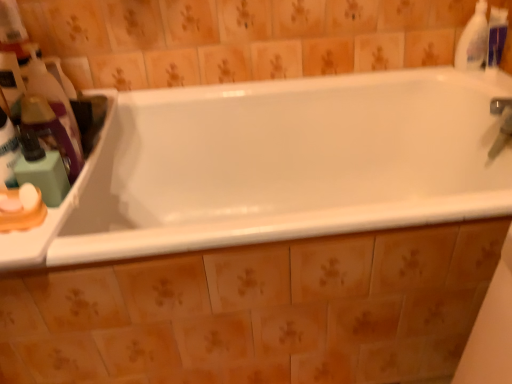
Locate an element on the screen. This screenshot has width=512, height=384. white plastic counter at left is located at coordinates (41, 228).

Locate an element on the screen. Image resolution: width=512 pixels, height=384 pixels. matte green soap at left is located at coordinates (42, 169).

Measure the distance between white glossy bathtub at center and camera.

white glossy bathtub at center and camera are 1.07 meters apart from each other.

The width and height of the screenshot is (512, 384). In order to click on white plastic counter at left in this screenshot , I will do `click(41, 228)`.

Where is `the 1st cleaning product directly above the translucent plastic bottle at left, marked as the 1th cleaning product in a front-to-back arrangement (from a real-world perspective)`? The image size is (512, 384). the 1st cleaning product directly above the translucent plastic bottle at left, marked as the 1th cleaning product in a front-to-back arrangement (from a real-world perspective) is located at coordinates (473, 40).

Is translucent plastic bottle at left, which is the third cleaning product in back-to-front order, bigger or smaller than white plastic bottle at upper right, the first cleaning product when ordered from back to front?

In the image, translucent plastic bottle at left, which is the third cleaning product in back-to-front order, appears to be larger than white plastic bottle at upper right, the first cleaning product when ordered from back to front.

Considering the sizes of objects matte green soap at left and translucent plastic bottle at left, the 1th cleaning product when ordered from left to right, in the image provided, who is thinner, matte green soap at left or translucent plastic bottle at left, the 1th cleaning product when ordered from left to right,?

Thinner between the two is matte green soap at left.

Between point (33, 157) and point (45, 68), which one is positioned behind?

The point (45, 68) is more distant.

Is matte green soap at left facing away from translucent plastic bottle at left, the 1th cleaning product when ordered from left to right?

No.

Is point (474, 48) closer to viewer compared to point (47, 121)?

No, (474, 48) is behind (47, 121).

Which of these two, white plastic bottle at upper right, which is the 1th cleaning product from right to left, or translucent plastic bottle at left, which is the third cleaning product in back-to-front order, stands taller?

white plastic bottle at upper right, which is the 1th cleaning product from right to left, is taller.

Would you consider white glossy bathtub at center to be distant from white plastic counter at left?

No, white glossy bathtub at center is in close proximity to white plastic counter at left.

From the image's perspective, would you say white glossy bathtub at center is positioned over white plastic counter at left?

No, from the image's perspective, white glossy bathtub at center is not on top of white plastic counter at left.

Could you tell me if white glossy bathtub at center is turned towards white plastic counter at left?

No, white glossy bathtub at center is not facing towards white plastic counter at left.

Which object is further away from the camera taking this photo, white glossy bathtub at center or white plastic bottle at upper right, the first cleaning product when ordered from back to front?

white plastic bottle at upper right, the first cleaning product when ordered from back to front, is further away from the camera.

Is point (358, 146) positioned before point (475, 44)?

No, it is not.

You are a GUI agent. You are given a task and a screenshot of the screen. Output one action in this format:
    pyautogui.click(x=<x>, y=<y>)
    Task: Click on the bathtub below the white plastic bottle at upper right, the third cleaning product viewed from the front (from the image's perspective)
    Image resolution: width=512 pixels, height=384 pixels.
    Given the screenshot: What is the action you would take?
    pos(278,166)

Measure the distance between translucent plastic bottle at left, the 1th cleaning product when ordered from left to right, and white glossy bathtub at center.

translucent plastic bottle at left, the 1th cleaning product when ordered from left to right, is 22.58 inches away from white glossy bathtub at center.

Consider the image. Is translucent plastic bottle at left, marked as the 2th cleaning product in a back-to-front arrangement, located outside white glossy bathtub at center?

Yes, translucent plastic bottle at left, marked as the 2th cleaning product in a back-to-front arrangement, is located beyond the bounds of white glossy bathtub at center.

There is a white glossy bathtub at center. Where is `the 2nd cleaning product above it (from the image's perspective)`? Image resolution: width=512 pixels, height=384 pixels. the 2nd cleaning product above it (from the image's perspective) is located at coordinates (53, 99).

Considering the points (67, 123) and (379, 102), which point is behind, point (67, 123) or point (379, 102)?

Positioned behind is point (379, 102).

Which of these two, translucent plastic bottle at left, acting as the second cleaning product starting from the right, or white glossy bathtub at center, stands shorter?

translucent plastic bottle at left, acting as the second cleaning product starting from the right.

Choose the correct answer: Is translucent plastic bottle at left, which is the third cleaning product in back-to-front order, inside white glossy bathtub at center or outside it?

translucent plastic bottle at left, which is the third cleaning product in back-to-front order, is not inside white glossy bathtub at center, it's outside.

From the image's perspective, is translucent plastic bottle at left, marked as the 1th cleaning product in a front-to-back arrangement, above or below white glossy bathtub at center?

translucent plastic bottle at left, marked as the 1th cleaning product in a front-to-back arrangement, is above white glossy bathtub at center.

From the image's perspective, starting from the translucent plastic bottle at left, acting as the second cleaning product starting from the right, which cleaning product is the 2nd one above? Please provide its 2D coordinates.

[(473, 40)]

Locate an element on the screen. The image size is (512, 384). toiletry in front of the translucent plastic bottle at left, marked as the 2th cleaning product in a back-to-front arrangement is located at coordinates (42, 169).

From the image, which object appears to be nearer to white plastic bottle at upper right, the first cleaning product when ordered from back to front, translucent plastic bottle at left, acting as the third cleaning product starting from the right, or white plastic counter at left?

white plastic counter at left lies closer to white plastic bottle at upper right, the first cleaning product when ordered from back to front, than the other object.

When comparing their distances from white plastic bottle at upper right, the third cleaning product viewed from the front, does white glossy bathtub at center or translucent plastic bottle at left, acting as the 2th cleaning product starting from the left, seem closer?

Among the two, white glossy bathtub at center is located nearer to white plastic bottle at upper right, the third cleaning product viewed from the front.

Considering their positions, is white plastic counter at left positioned closer to translucent plastic bottle at left, marked as the 2th cleaning product in a back-to-front arrangement, than matte green soap at left?

matte green soap at left is positioned closer to the anchor translucent plastic bottle at left, marked as the 2th cleaning product in a back-to-front arrangement.

When comparing their distances from white plastic counter at left, does white plastic bottle at upper right, the first cleaning product when ordered from back to front, or translucent plastic bottle at left, the 1th cleaning product when ordered from left to right, seem further?

white plastic bottle at upper right, the first cleaning product when ordered from back to front.

From the image, which object appears to be farther from matte green soap at left, translucent plastic bottle at left, the 1th cleaning product when ordered from left to right, or white plastic counter at left?

white plastic counter at left lies further to matte green soap at left than the other object.

Considering their positions, is matte green soap at left positioned closer to white plastic bottle at upper right, the third cleaning product viewed from the front, than translucent plastic bottle at left, acting as the second cleaning product starting from the right?

translucent plastic bottle at left, acting as the second cleaning product starting from the right, is closer to white plastic bottle at upper right, the third cleaning product viewed from the front.

Considering their positions, is translucent plastic bottle at left, the 1th cleaning product when ordered from left to right, positioned closer to translucent plastic bottle at left, which is the third cleaning product in back-to-front order, than white plastic bottle at upper right, the first cleaning product when ordered from back to front?

The object closer to translucent plastic bottle at left, which is the third cleaning product in back-to-front order, is translucent plastic bottle at left, the 1th cleaning product when ordered from left to right.

Considering their positions, is translucent plastic bottle at left, marked as the 1th cleaning product in a front-to-back arrangement, positioned closer to matte green soap at left than white plastic bottle at upper right, the third cleaning product in the left-to-right sequence?

translucent plastic bottle at left, marked as the 1th cleaning product in a front-to-back arrangement.

This screenshot has width=512, height=384. What are the coordinates of `cleaning product between white plastic counter at left and translucent plastic bottle at left, the 1th cleaning product when ordered from left to right, along the z-axis` in the screenshot? It's located at (50, 131).

The image size is (512, 384). I want to click on cleaning product situated between matte green soap at left and white glossy bathtub at center from left to right, so click(50, 131).

The width and height of the screenshot is (512, 384). I want to click on toiletry located between translucent plastic bottle at left, the 1th cleaning product when ordered from left to right, and white glossy bathtub at center in the left-right direction, so click(42, 169).

Locate an element on the screen. The width and height of the screenshot is (512, 384). cleaning product between translucent plastic bottle at left, marked as the 2th cleaning product in a back-to-front arrangement, and white glossy bathtub at center, in the horizontal direction is located at coordinates (50, 131).